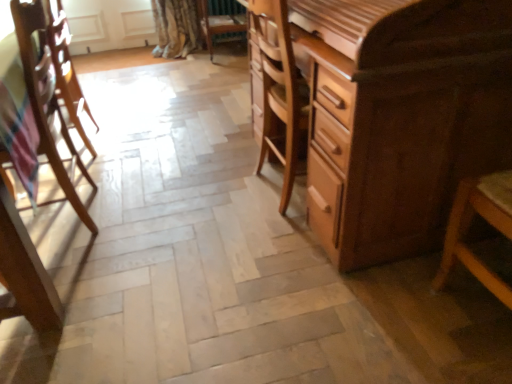
What is the approximate width of wooden chair at center, the 2th chair when ordered from bottom to top?

wooden chair at center, the 2th chair when ordered from bottom to top, is 17.38 inches wide.

In order to click on shiny brown wooden chest of drawers at right in this screenshot , I will do point(400,117).

Where is `wooden chair at left, which is the second chair in back-to-front order`? The width and height of the screenshot is (512, 384). wooden chair at left, which is the second chair in back-to-front order is located at coordinates point(46,100).

From the image's perspective, relative to wooden chair at center, the 2th chair when ordered from bottom to top, is wooden armchair at left above or below?

Based on their image positions, wooden armchair at left is located beneath wooden chair at center, the 2th chair when ordered from bottom to top.

Is the surface of wooden armchair at left in direct contact with wooden chair at center, which appears as the second chair when viewed from the left?

wooden armchair at left and wooden chair at center, which appears as the second chair when viewed from the left, are not in contact.

Do you think wooden armchair at left is within wooden chair at center, the first chair when ordered from top to bottom, or outside of it?

wooden armchair at left cannot be found inside wooden chair at center, the first chair when ordered from top to bottom.

You are a GUI agent. You are given a task and a screenshot of the screen. Output one action in this format:
    pyautogui.click(x=<x>, y=<y>)
    Task: Click on the armchair below the wooden chair at center, the 2th chair positioned from the front (from the image's perspective)
    
    Given the screenshot: What is the action you would take?
    pyautogui.click(x=66, y=68)

I want to click on the 2nd chair to the left of the shiny brown wooden chest of drawers at right, starting your count from the anchor, so click(x=46, y=100).

Which object is wider, shiny brown wooden chest of drawers at right or wooden chair at left, which is the 1th chair in bottom-to-top order?

With larger width is shiny brown wooden chest of drawers at right.

Is shiny brown wooden chest of drawers at right oriented towards wooden chair at left, which is the second chair in back-to-front order?

Yes, shiny brown wooden chest of drawers at right is aimed at wooden chair at left, which is the second chair in back-to-front order.

Considering the relative sizes of shiny brown wooden chest of drawers at right and wooden chair at left, which is the 1th chair in bottom-to-top order, in the image provided, is shiny brown wooden chest of drawers at right taller than wooden chair at left, which is the 1th chair in bottom-to-top order,?

Yes.

From a real-world perspective, is wooden armchair at left above or below wooden chair at left, which is the 1th chair in bottom-to-top order?

wooden armchair at left is above wooden chair at left, which is the 1th chair in bottom-to-top order.

You are a GUI agent. You are given a task and a screenshot of the screen. Output one action in this format:
    pyautogui.click(x=<x>, y=<y>)
    Task: Click on the chair on the left side of wooden armchair at left
    This screenshot has width=512, height=384.
    Given the screenshot: What is the action you would take?
    pyautogui.click(x=46, y=100)

Between point (61, 46) and point (54, 96), which one is positioned behind?

Positioned behind is point (61, 46).

Which is behind, wooden chair at left, the first chair in the left-to-right sequence, or shiny brown wooden chest of drawers at right?

shiny brown wooden chest of drawers at right is further away from the camera.

Is wooden chair at left, the first chair in the left-to-right sequence, shorter than shiny brown wooden chest of drawers at right?

Yes, wooden chair at left, the first chair in the left-to-right sequence, is shorter than shiny brown wooden chest of drawers at right.

Who is bigger, wooden chair at left, the 2th chair viewed from the top, or shiny brown wooden chest of drawers at right?

With larger size is wooden chair at left, the 2th chair viewed from the top.

Where is `chair in front of the shiny brown wooden chest of drawers at right`? Image resolution: width=512 pixels, height=384 pixels. chair in front of the shiny brown wooden chest of drawers at right is located at coordinates (46, 100).

Looking at the image, does wooden armchair at left seem bigger or smaller compared to shiny brown wooden chest of drawers at right?

In the image, wooden armchair at left appears to be smaller than shiny brown wooden chest of drawers at right.

From a real-world perspective, is wooden armchair at left over shiny brown wooden chest of drawers at right?

No, from a real-world perspective, wooden armchair at left is not above shiny brown wooden chest of drawers at right.

In the scene shown: Is wooden armchair at left positioned beyond the bounds of shiny brown wooden chest of drawers at right?

That's correct, wooden armchair at left is outside of shiny brown wooden chest of drawers at right.

Who is smaller, wooden chair at left, placed as the second chair when sorted from right to left, or wooden armchair at left?

Smaller between the two is wooden armchair at left.

Does wooden chair at left, placed as the second chair when sorted from right to left, have a lesser width compared to wooden armchair at left?

No, wooden chair at left, placed as the second chair when sorted from right to left, is not thinner than wooden armchair at left.

From a real-world perspective, who is located higher, wooden chair at left, the first chair in the left-to-right sequence, or wooden armchair at left?

In real-world perspective, wooden armchair at left is above.

Find the location of a particular element. This screenshot has height=384, width=512. chair below the wooden chair at center, the 2th chair positioned from the front (from the image's perspective) is located at coordinates (46, 100).

Is wooden chair at center, the 2th chair positioned from the front, facing towards wooden chair at left, which appears as the 1th chair when viewed from the front?

No, wooden chair at center, the 2th chair positioned from the front, is not aimed at wooden chair at left, which appears as the 1th chair when viewed from the front.

Can you confirm if wooden chair at center, the 2th chair positioned from the front, is shorter than wooden chair at left, the first chair in the left-to-right sequence?

Correct, wooden chair at center, the 2th chair positioned from the front, is not as tall as wooden chair at left, the first chair in the left-to-right sequence.

Is wooden chair at center, positioned as the first chair in back-to-front order, to the left or to the right of wooden chair at left, the first chair in the left-to-right sequence, in the image?

wooden chair at center, positioned as the first chair in back-to-front order, is to the right of wooden chair at left, the first chair in the left-to-right sequence.

This screenshot has width=512, height=384. What are the coordinates of `the 2nd chair below the wooden armchair at left (from a real-world perspective)` in the screenshot? It's located at (221, 21).

Identify the location of chest of drawers on the right of wooden chair at left, which appears as the 1th chair when viewed from the front. The height and width of the screenshot is (384, 512). (400, 117).

Based on the photo, from the image, which object appears to be farther from wooden armchair at left, wooden chair at left, the first chair in the left-to-right sequence, or wooden chair at center, the 2th chair positioned from the front?

Based on the image, wooden chair at center, the 2th chair positioned from the front, appears to be further to wooden armchair at left.

Which object lies nearer to the anchor point wooden chair at center, the first chair when ordered from top to bottom, shiny brown wooden chest of drawers at right or wooden armchair at left?

wooden armchair at left is closer to wooden chair at center, the first chair when ordered from top to bottom.

Which object lies nearer to the anchor point wooden chair at center, the first chair when ordered from top to bottom, wooden armchair at left or shiny brown wooden chest of drawers at right?

Based on the image, wooden armchair at left appears to be nearer to wooden chair at center, the first chair when ordered from top to bottom.

Looking at the image, which one is located further to shiny brown wooden chest of drawers at right, wooden armchair at left or wooden chair at left, which appears as the 1th chair when viewed from the front?

Based on the image, wooden armchair at left appears to be further to shiny brown wooden chest of drawers at right.

Considering their positions, is wooden chair at left, the first chair in the left-to-right sequence, positioned closer to wooden chair at center, positioned as the first chair in back-to-front order, than shiny brown wooden chest of drawers at right?

wooden chair at left, the first chair in the left-to-right sequence, is positioned closer to the anchor wooden chair at center, positioned as the first chair in back-to-front order.

Considering their positions, is wooden armchair at left positioned closer to shiny brown wooden chest of drawers at right than wooden chair at center, the 2th chair positioned from the front?

Based on the image, wooden armchair at left appears to be nearer to shiny brown wooden chest of drawers at right.

Based on their spatial positions, is shiny brown wooden chest of drawers at right or wooden chair at center, which appears as the second chair when viewed from the left, further from wooden armchair at left?

wooden chair at center, which appears as the second chair when viewed from the left.

Considering their positions, is wooden chair at left, the 2th chair viewed from the top, positioned closer to wooden chair at center, which appears as the second chair when viewed from the left, than wooden armchair at left?

wooden armchair at left lies closer to wooden chair at center, which appears as the second chair when viewed from the left, than the other object.

The width and height of the screenshot is (512, 384). What are the coordinates of `armchair positioned between wooden chair at left, which appears as the 1th chair when viewed from the front, and wooden chair at center, which appears as the second chair when viewed from the left, from near to far` in the screenshot? It's located at (66, 68).

This screenshot has height=384, width=512. Find the location of `the chest of drawers located between wooden chair at left, placed as the second chair when sorted from right to left, and wooden chair at center, which appears as the second chair when viewed from the left, in the depth direction`. the chest of drawers located between wooden chair at left, placed as the second chair when sorted from right to left, and wooden chair at center, which appears as the second chair when viewed from the left, in the depth direction is located at coordinates (400, 117).

This screenshot has width=512, height=384. In order to click on armchair positioned between shiny brown wooden chest of drawers at right and wooden chair at center, placed as the 1th chair when sorted from right to left, from near to far in this screenshot , I will do `click(66, 68)`.

At what (x,y) coordinates should I click in order to perform the action: click on armchair between wooden chair at left, the 2th chair viewed from the top, and shiny brown wooden chest of drawers at right, in the horizontal direction. Please return your answer as a coordinate pair (x, y). Looking at the image, I should click on (66, 68).